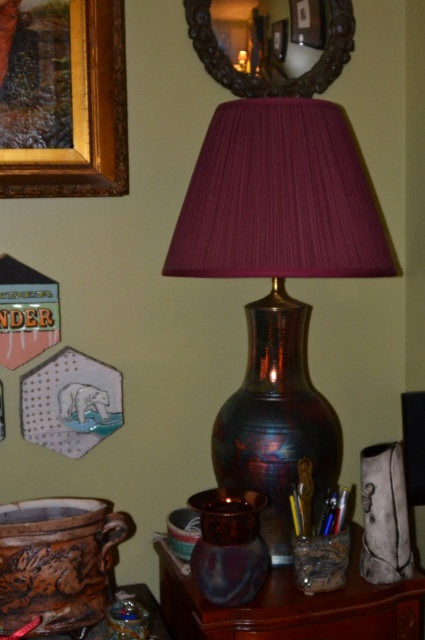
You are standing in the room and want to place a small vase on the table. The vase is exactly at point (277, 276). Which object is the vase currently on?

The vase is currently on the metallic maroon lampshade at center, as point (277, 276) is located there.

You are arranging flowers in the room and want to place a bouquet in the translucent glass vase at lower center. To ensure it doesn not block the reflection in the wooden frame mirror at upper center, where should you position the vase relative to the mirror?

The translucent glass vase at lower center is already positioned to the left of the wooden frame mirror at upper center, so placing the bouquet there won not obstruct the mirror.

You are a delivery person who needs to place a package between the translucent glass vase at lower center and the wooden frame mirror at upper center. The package is 1.0 meters long. Will it fit in the space between them?

Answer: The distance between the translucent glass vase at lower center and the wooden frame mirror at upper center is 1.04 meters. Since the package is 1.0 meters long, it will fit with a small amount of space remaining.